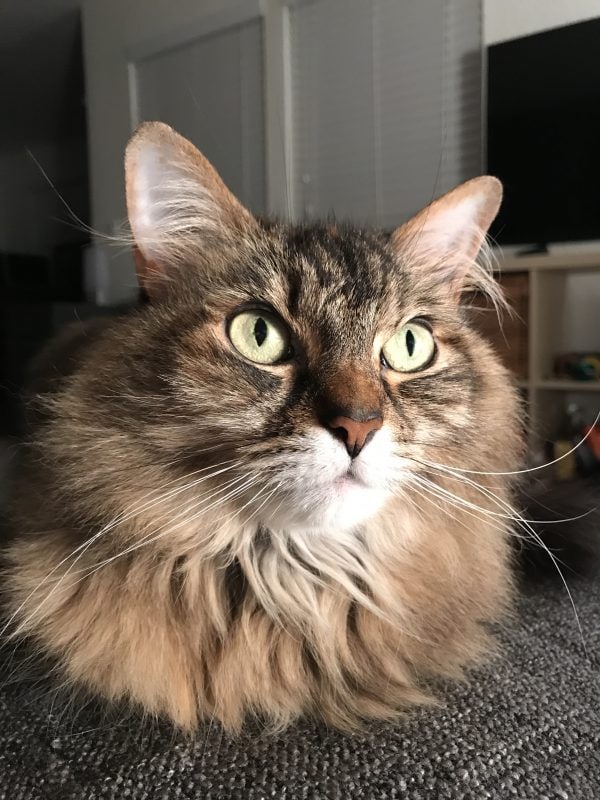
Find the location of a particular element. carpet is located at coordinates (515, 740), (91, 766).